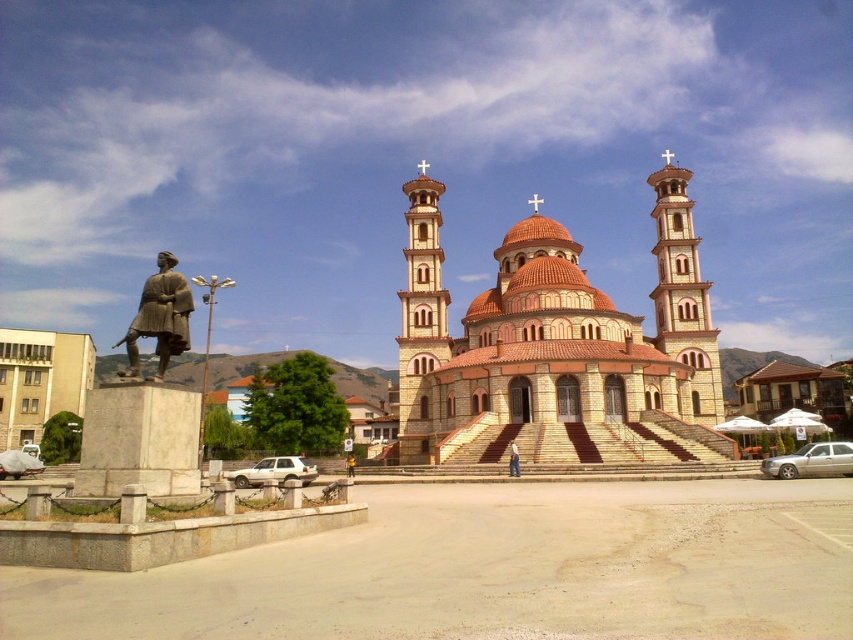
You are standing in front of the church and want to take a photo that includes both the statue and the central dome. The statue is located at point (80,474) and the central dome is at point (515,452). Based on their positions, which point is closer to you and should be framed first in your photo?

Point (80,474) is closer to the camera than point (515,452), so you should frame the statue at point (80,474) first to ensure it appears larger and more prominent in the photo.